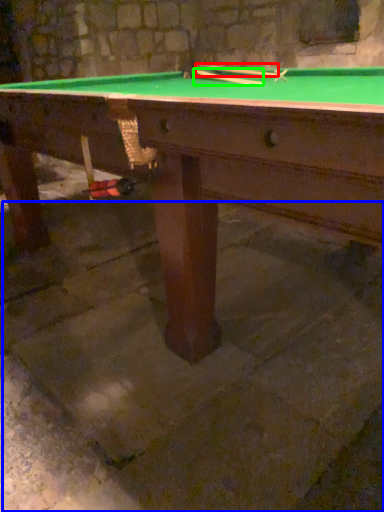
Question: Which object is positioned closest to cue (highlighted by a red box)? Select from concrete (highlighted by a blue box) and cue (highlighted by a green box).

Choices:
 (A) concrete
 (B) cue

Answer: (B)